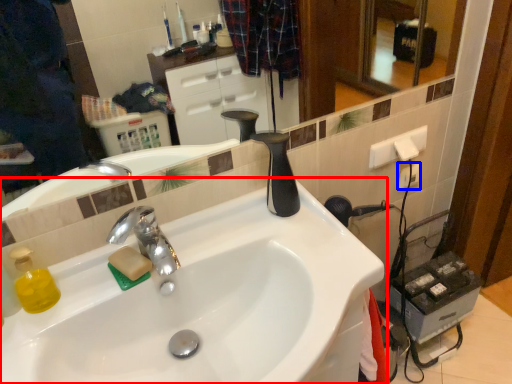
Question: Among these objects, which one is nearest to the camera, sink (highlighted by a red box) or electric outlet (highlighted by a blue box)?

Choices:
 (A) sink
 (B) electric outlet

Answer: (A)